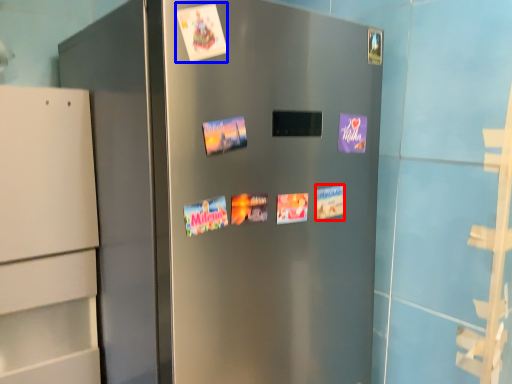
Question: Among these objects, which one is farthest to the camera, postcard (highlighted by a red box) or flyer (highlighted by a blue box)?

Choices:
 (A) postcard
 (B) flyer

Answer: (A)